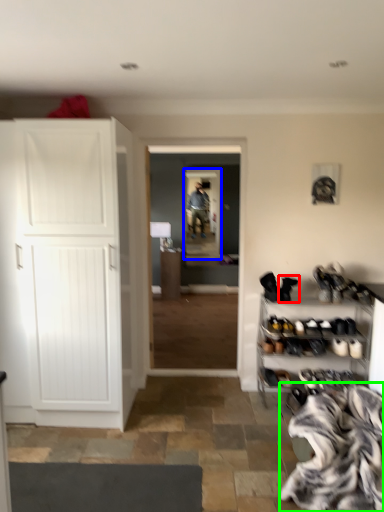
Question: Considering the real-world distances, which object is farthest from footwear (highlighted by a red box)? screen door (highlighted by a blue box) or blanket (highlighted by a green box)?

Choices:
 (A) screen door
 (B) blanket

Answer: (A)